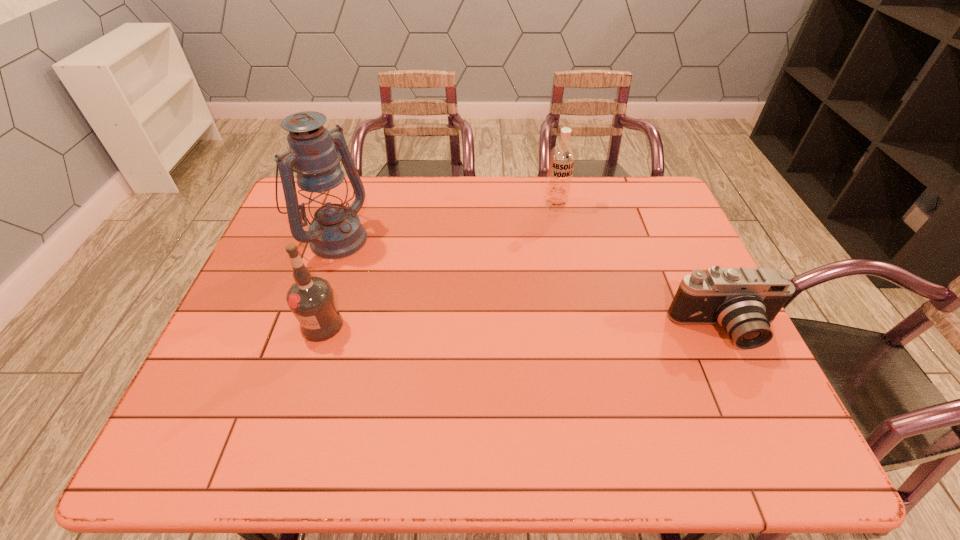
Where is `empty space that is in between the left vodka and the camera`? empty space that is in between the left vodka and the camera is located at coordinates (523, 328).

Image resolution: width=960 pixels, height=540 pixels. In order to click on vacant area that lies between the tallest object and the nearer vodka in this screenshot , I will do `click(327, 281)`.

This screenshot has height=540, width=960. I want to click on free spot between the shortest object and the right vodka, so click(x=640, y=268).

Locate an element on the screen. vacant space that is in between the nearer vodka and the rightmost object is located at coordinates [x=523, y=328].

Locate which object ranks in proximity to the second object from right to left. Please provide its 2D coordinates. Your answer should be formatted as a tuple, i.e. [(x, y)], where the tuple contains the x and y coordinates of a point satisfying the conditions above.

[(744, 301)]

Locate an element on the screen. The width and height of the screenshot is (960, 540). object identified as the third closest to the farther vodka is located at coordinates (311, 299).